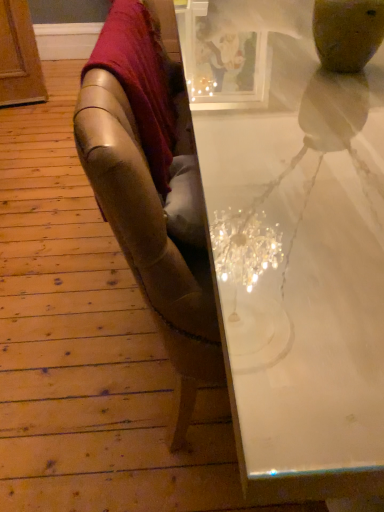
The image size is (384, 512). Describe the element at coordinates (142, 81) in the screenshot. I see `velvet red blanket at upper left` at that location.

What are the coordinates of `velvet red blanket at upper left` in the screenshot? It's located at (142, 81).

What do you see at coordinates (292, 243) in the screenshot? I see `white glossy table at upper right` at bounding box center [292, 243].

What is the approximate height of white glossy table at upper right?

It is 30.89 inches.

You are a GUI agent. You are given a task and a screenshot of the screen. Output one action in this format:
    pyautogui.click(x=<x>, y=<y>)
    Task: Click on the white glossy table at upper right
    
    Given the screenshot: What is the action you would take?
    (x=292, y=243)

Where is `velvet red blanket at upper left`? velvet red blanket at upper left is located at coordinates (142, 81).

Is white glossy table at upper right at the left side of velvet red blanket at upper left?

Incorrect, white glossy table at upper right is not on the left side of velvet red blanket at upper left.

Considering the positions of objects white glossy table at upper right and velvet red blanket at upper left in the image provided, who is in front, white glossy table at upper right or velvet red blanket at upper left?

white glossy table at upper right is closer to the camera.

Considering the points (228, 229) and (125, 6), which point is behind, point (228, 229) or point (125, 6)?

The point (125, 6) is more distant.

From the image's perspective, is white glossy table at upper right located above or below velvet red blanket at upper left?

From the image's perspective, white glossy table at upper right appears below velvet red blanket at upper left.

From a real-world perspective, is white glossy table at upper right physically located above or below velvet red blanket at upper left?

white glossy table at upper right is below velvet red blanket at upper left.

Is white glossy table at upper right thinner than velvet red blanket at upper left?

No, white glossy table at upper right is not thinner than velvet red blanket at upper left.

Considering the sizes of objects white glossy table at upper right and velvet red blanket at upper left in the image provided, who is taller, white glossy table at upper right or velvet red blanket at upper left?

With more height is white glossy table at upper right.

Based on their sizes in the image, would you say white glossy table at upper right is bigger or smaller than velvet red blanket at upper left?

Considering their sizes, white glossy table at upper right takes up more space than velvet red blanket at upper left.

Is white glossy table at upper right completely or partially outside of velvet red blanket at upper left?

Yes, white glossy table at upper right is located beyond the bounds of velvet red blanket at upper left.

Is white glossy table at upper right placed right next to velvet red blanket at upper left?

white glossy table at upper right and velvet red blanket at upper left are not in contact.

Is white glossy table at upper right facing away from velvet red blanket at upper left?

No, white glossy table at upper right's orientation is not away from velvet red blanket at upper left.

Locate an element on the screen. blanket above the white glossy table at upper right (from a real-world perspective) is located at coordinates (142, 81).

In the image, is velvet red blanket at upper left on the left side or the right side of white glossy table at upper right?

In the image, velvet red blanket at upper left appears on the left side of white glossy table at upper right.

Which is behind, velvet red blanket at upper left or white glossy table at upper right?

velvet red blanket at upper left is more distant.

Is point (161, 63) more distant than point (197, 49)?

Yes.

From the image's perspective, which object appears higher, velvet red blanket at upper left or white glossy table at upper right?

velvet red blanket at upper left is shown above in the image.

In the scene shown: From a real-world perspective, is velvet red blanket at upper left physically above white glossy table at upper right?

Indeed, from a real-world perspective, velvet red blanket at upper left stands above white glossy table at upper right.

Which object is thinner, velvet red blanket at upper left or white glossy table at upper right?

With smaller width is velvet red blanket at upper left.

Who is shorter, velvet red blanket at upper left or white glossy table at upper right?

velvet red blanket at upper left.

Between velvet red blanket at upper left and white glossy table at upper right, which one has larger size?

white glossy table at upper right.

Which is correct: velvet red blanket at upper left is inside white glossy table at upper right, or outside of it?

velvet red blanket at upper left is outside white glossy table at upper right.

Is the surface of velvet red blanket at upper left in direct contact with white glossy table at upper right?

No, velvet red blanket at upper left is not touching white glossy table at upper right.

Is velvet red blanket at upper left turned away from white glossy table at upper right?

velvet red blanket at upper left does not have its back to white glossy table at upper right.

What's the angular difference between velvet red blanket at upper left and white glossy table at upper right's facing directions?

The angular difference between velvet red blanket at upper left and white glossy table at upper right is 91.8 degrees.

Measure the distance from velvet red blanket at upper left to white glossy table at upper right.

velvet red blanket at upper left and white glossy table at upper right are 32.45 centimeters apart.

Find the location of a particular element. table directly beneath the velvet red blanket at upper left (from a real-world perspective) is located at coordinates (292, 243).

Locate an element on the screen. The image size is (384, 512). blanket on the left of white glossy table at upper right is located at coordinates (142, 81).

Where is `blanket above the white glossy table at upper right (from the image's perspective)`? This screenshot has height=512, width=384. blanket above the white glossy table at upper right (from the image's perspective) is located at coordinates (142, 81).